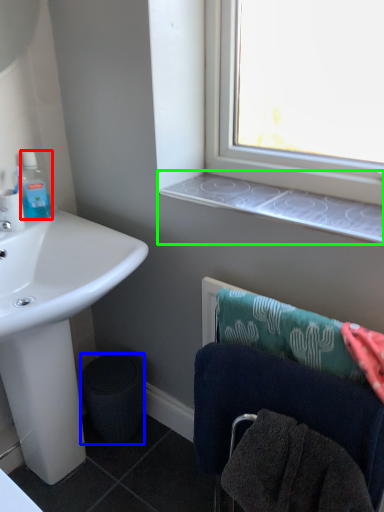
Question: Considering the real-world distances, which object is closest to bottle (highlighted by a red box)? trash bin/can (highlighted by a blue box) or window sill (highlighted by a green box).

Choices:
 (A) trash bin/can
 (B) window sill

Answer: (B)